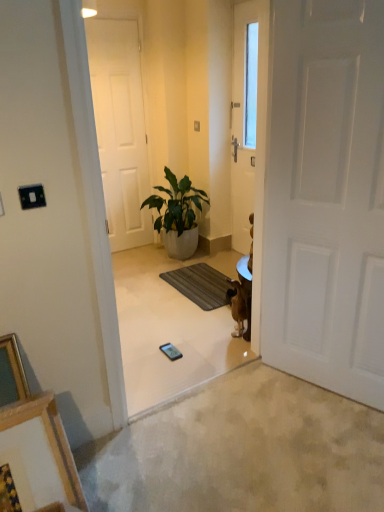
Question: Considering the relative sizes of green leafy plant in white pot at center and white matte door at center, positioned as the second door in front-to-back order, in the image provided, is green leafy plant in white pot at center shorter than white matte door at center, positioned as the second door in front-to-back order,?

Choices:
 (A) no
 (B) yes

Answer: (B)

Question: From the image's perspective, is green leafy plant in white pot at center on top of white matte door at center, which is the second door from right to left?

Choices:
 (A) no
 (B) yes

Answer: (A)

Question: Does green leafy plant in white pot at center have a greater height compared to white matte door at center, which is the second door from right to left?

Choices:
 (A) yes
 (B) no

Answer: (B)

Question: Is green leafy plant in white pot at center turned away from white matte door at center, which is counted as the 1th door, starting from the left?

Choices:
 (A) no
 (B) yes

Answer: (A)

Question: From a real-world perspective, does green leafy plant in white pot at center sit lower than white matte door at center, which is the second door from right to left?

Choices:
 (A) no
 (B) yes

Answer: (B)

Question: Considering the positions of point (115, 201) and point (192, 286), is point (115, 201) closer or farther from the camera than point (192, 286)?

Choices:
 (A) farther
 (B) closer

Answer: (A)

Question: Would you say white matte door at center, which is counted as the 1th door, starting from the left, is inside or outside dark gray textured mat at center?

Choices:
 (A) inside
 (B) outside

Answer: (B)

Question: From the image's perspective, is white matte door at center, which is counted as the 1th door, starting from the back, located above or below dark gray textured mat at center?

Choices:
 (A) below
 (B) above

Answer: (B)

Question: Is white matte door at center, which is counted as the 1th door, starting from the left, to the left or to the right of dark gray textured mat at center in the image?

Choices:
 (A) left
 (B) right

Answer: (A)

Question: Considering the positions of dark gray textured mat at center and brown fur dog at center-right in the image, is dark gray textured mat at center wider or thinner than brown fur dog at center-right?

Choices:
 (A) wide
 (B) thin

Answer: (A)

Question: From a real-world perspective, is dark gray textured mat at center physically located above or below brown fur dog at center-right?

Choices:
 (A) below
 (B) above

Answer: (A)

Question: Does point (205, 285) appear closer or farther from the camera than point (233, 283)?

Choices:
 (A) closer
 (B) farther

Answer: (B)

Question: In the image, is dark gray textured mat at center on the left side or the right side of brown fur dog at center-right?

Choices:
 (A) left
 (B) right

Answer: (A)

Question: Is white matte door at center, which is counted as the 1th door, starting from the left, bigger or smaller than green leafy plant in white pot at center?

Choices:
 (A) small
 (B) big

Answer: (A)

Question: Do you think white matte door at center, which is counted as the 1th door, starting from the left, is within green leafy plant in white pot at center, or outside of it?

Choices:
 (A) inside
 (B) outside

Answer: (B)